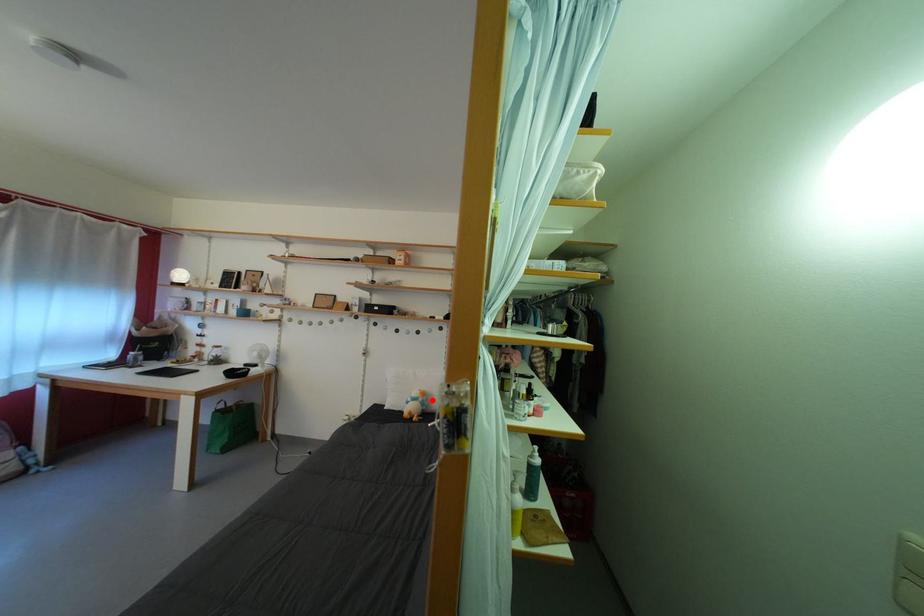
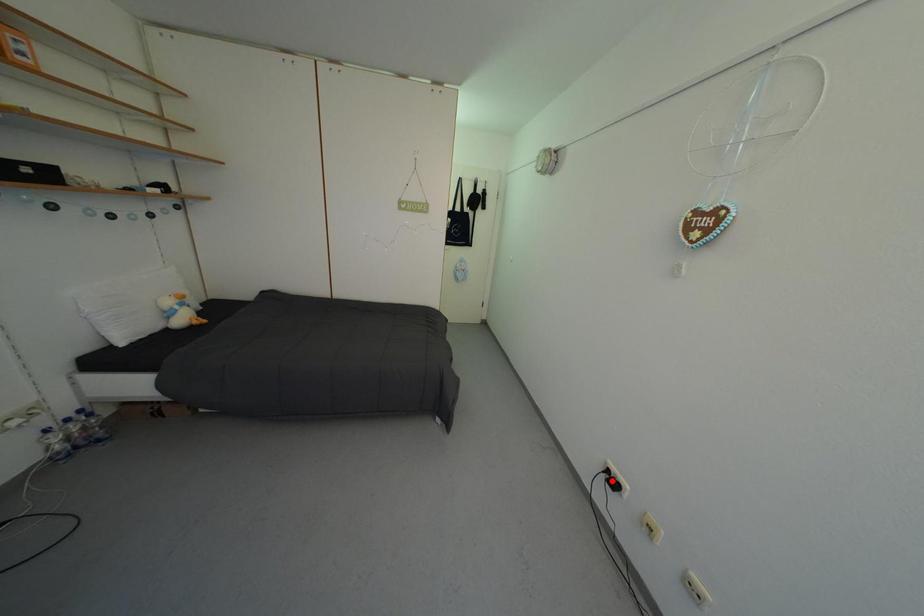
I am providing you with two images of the same scene from different viewpoints. A red point is marked on the first image and another point is marked on the second image. Does the point marked in image1 correspond to the same location as the one in image2?

No